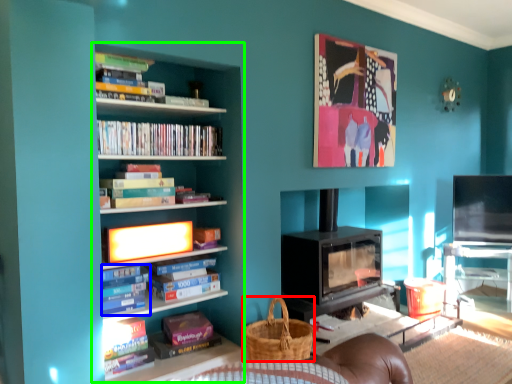
Question: Based on their relative distances, which object is nearer to basket (highlighted by a red box)? Choose from book (highlighted by a blue box) and bookcase (highlighted by a green box).

Choices:
 (A) book
 (B) bookcase

Answer: (B)